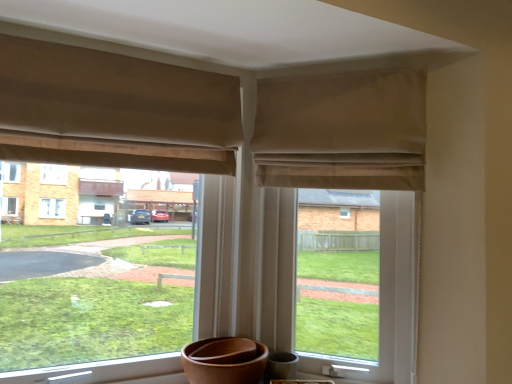
Question: Is beige fabric at upper center further to the viewer compared to beige fabric window at center?

Choices:
 (A) no
 (B) yes

Answer: (B)

Question: Does beige fabric at upper center have a greater width compared to beige fabric window at center?

Choices:
 (A) no
 (B) yes

Answer: (B)

Question: Considering the relative sizes of beige fabric at upper center and beige fabric window at center in the image provided, is beige fabric at upper center thinner than beige fabric window at center?

Choices:
 (A) yes
 (B) no

Answer: (B)

Question: Is beige fabric at upper center facing away from beige fabric window at center?

Choices:
 (A) no
 (B) yes

Answer: (A)

Question: Is beige fabric at upper center located outside beige fabric window at center?

Choices:
 (A) no
 (B) yes

Answer: (B)

Question: Is beige fabric window at center in front of or behind beige fabric curtain at upper center, which is counted as the first curtain, starting from the right, in the image?

Choices:
 (A) behind
 (B) front

Answer: (B)

Question: In terms of size, does beige fabric window at center appear bigger or smaller than beige fabric curtain at upper center, which is counted as the first curtain, starting from the right?

Choices:
 (A) small
 (B) big

Answer: (B)

Question: From a real-world perspective, is beige fabric window at center physically located above or below beige fabric curtain at upper center, which is the 2th curtain in left-to-right order?

Choices:
 (A) below
 (B) above

Answer: (A)

Question: In terms of width, does beige fabric window at center look wider or thinner when compared to beige fabric curtain at upper center, which is the 2th curtain in left-to-right order?

Choices:
 (A) thin
 (B) wide

Answer: (B)

Question: Based on their sizes in the image, would you say beige fabric at upper center is bigger or smaller than beige fabric window at center?

Choices:
 (A) small
 (B) big

Answer: (A)

Question: From a real-world perspective, is beige fabric at upper center physically located above or below beige fabric window at center?

Choices:
 (A) below
 (B) above

Answer: (B)

Question: Is beige fabric at upper center inside or outside of beige fabric window at center?

Choices:
 (A) inside
 (B) outside

Answer: (B)

Question: In the image, is beige fabric at upper center on the left side or the right side of beige fabric window at center?

Choices:
 (A) right
 (B) left

Answer: (A)

Question: Considering the positions of beige fabric at upper center and beige fabric curtain at upper center, which is counted as the first curtain, starting from the right, in the image, is beige fabric at upper center wider or thinner than beige fabric curtain at upper center, which is counted as the first curtain, starting from the right,?

Choices:
 (A) wide
 (B) thin

Answer: (A)

Question: Based on their sizes in the image, would you say beige fabric at upper center is bigger or smaller than beige fabric curtain at upper center, which is the 2th curtain in left-to-right order?

Choices:
 (A) big
 (B) small

Answer: (A)